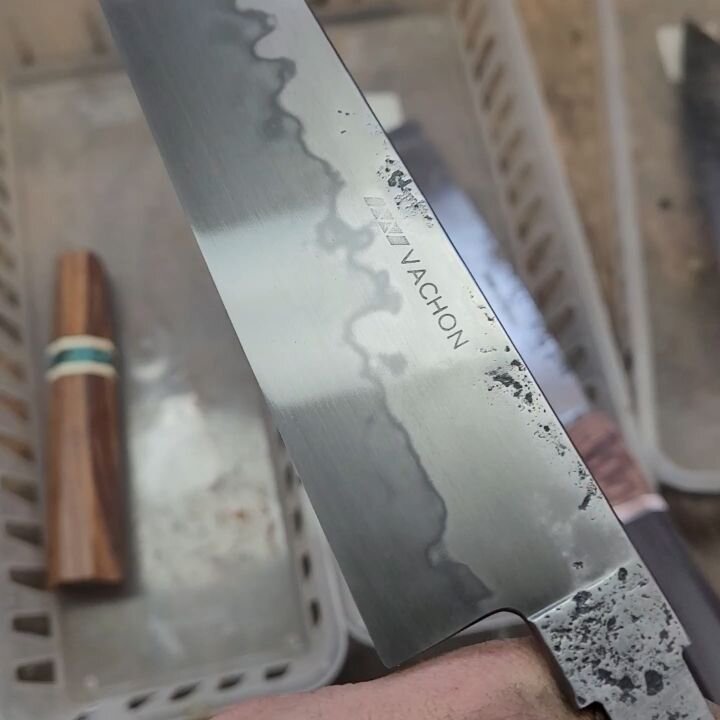
Where is `basket`? Image resolution: width=720 pixels, height=720 pixels. basket is located at coordinates (238, 569), (546, 242), (672, 258).